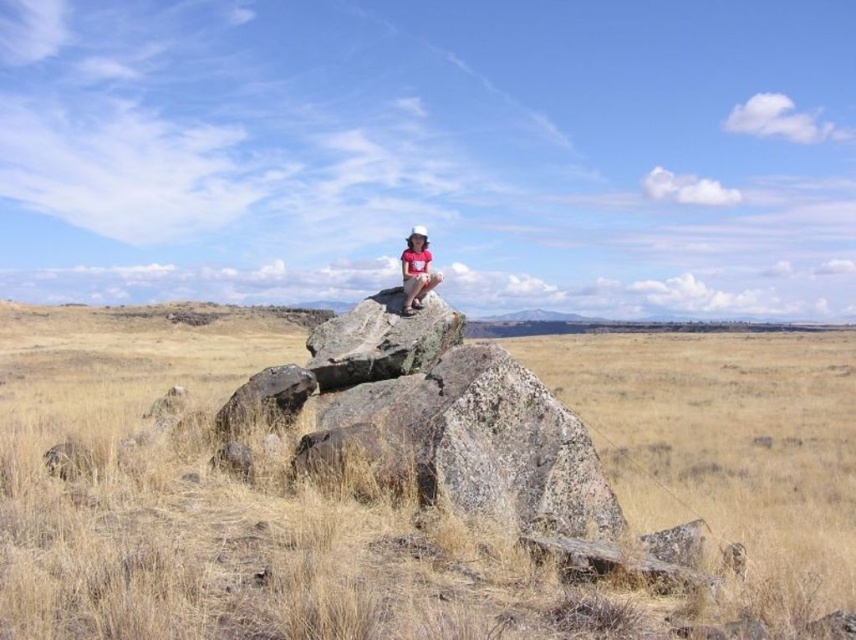
Question: Can you confirm if dry grass at center is positioned to the right of matte pink shirt at center?

Choices:
 (A) yes
 (B) no

Answer: (A)

Question: Can you confirm if dry grass at center is smaller than matte pink shirt at center?

Choices:
 (A) no
 (B) yes

Answer: (A)

Question: Which object is closer to the camera taking this photo?

Choices:
 (A) matte pink shirt at center
 (B) dry grass at center

Answer: (B)

Question: Can you confirm if dry grass at center is thinner than matte pink shirt at center?

Choices:
 (A) no
 (B) yes

Answer: (A)

Question: Which of the following is the closest to the observer?

Choices:
 (A) (419, 225)
 (B) (131, 593)

Answer: (B)

Question: Which point is farther from the camera taking this photo?

Choices:
 (A) (168, 564)
 (B) (400, 262)

Answer: (B)